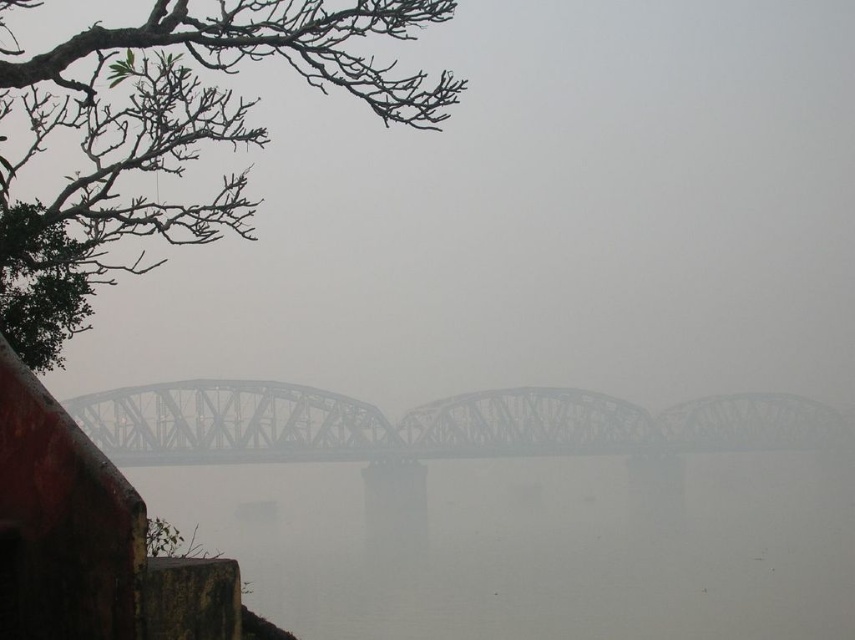
Looking at this image, who is shorter, foggy gray bridge at center or gray foggy river at center?

With less height is gray foggy river at center.

Who is more forward, (34, 33) or (432, 474)?

Point (34, 33)

Which is behind, point (588, 365) or point (208, 547)?

The point (588, 365) is behind.

Locate an element on the screen. foggy gray bridge at center is located at coordinates (532, 218).

Can you confirm if foggy gray bridge at center is positioned below steel bridge at center?

Actually, foggy gray bridge at center is above steel bridge at center.

Can you confirm if foggy gray bridge at center is positioned to the right of steel bridge at center?

Incorrect, foggy gray bridge at center is not on the right side of steel bridge at center.

Which is in front, point (823, 100) or point (338, 406)?

Point (338, 406) is more forward.

I want to click on foggy gray bridge at center, so click(532, 218).

Between gray foggy river at center and steel bridge at center, which one has less height?

gray foggy river at center is shorter.

Is gray foggy river at center thinner than steel bridge at center?

Yes, gray foggy river at center is thinner than steel bridge at center.

Is point (641, 513) positioned before point (529, 440)?

Yes, it is.

Find the location of a particular element. This screenshot has height=640, width=855. gray foggy river at center is located at coordinates (534, 545).